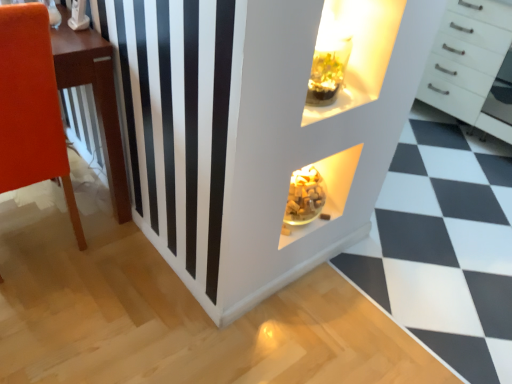
Question: In terms of size, does white glossy dresser at center appear bigger or smaller than matte orange chair at left?

Choices:
 (A) big
 (B) small

Answer: (B)

Question: Relative to matte orange chair at left, is white glossy dresser at center in front or behind?

Choices:
 (A) front
 (B) behind

Answer: (A)

Question: Estimate the real-world distances between objects in this image. Which object is farther from the white glossy chest of drawers at upper right?

Choices:
 (A) matte orange chair at left
 (B) white glossy dresser at center

Answer: (A)

Question: Considering the real-world distances, which object is closest to the white glossy chest of drawers at upper right?

Choices:
 (A) white glossy dresser at center
 (B) matte orange chair at left

Answer: (A)